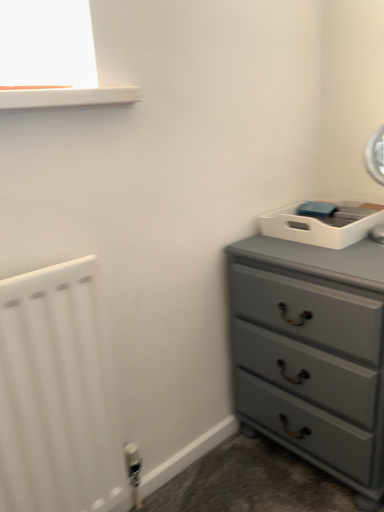
Question: Is white matte radiator at left located within matte gray dresser at right?

Choices:
 (A) no
 (B) yes

Answer: (A)

Question: Is matte gray dresser at right further to camera compared to white matte radiator at left?

Choices:
 (A) yes
 (B) no

Answer: (A)

Question: Considering the relative sizes of matte gray dresser at right and white matte radiator at left in the image provided, is matte gray dresser at right smaller than white matte radiator at left?

Choices:
 (A) yes
 (B) no

Answer: (B)

Question: Is matte gray dresser at right oriented away from white matte radiator at left?

Choices:
 (A) no
 (B) yes

Answer: (A)

Question: Are matte gray dresser at right and white matte radiator at left located far from each other?

Choices:
 (A) no
 (B) yes

Answer: (A)

Question: Considering the relative sizes of matte gray dresser at right and white matte radiator at left in the image provided, is matte gray dresser at right thinner than white matte radiator at left?

Choices:
 (A) yes
 (B) no

Answer: (B)

Question: Does white matte radiator at left have a larger size compared to matte gray dresser at right?

Choices:
 (A) yes
 (B) no

Answer: (B)

Question: From a real-world perspective, is white matte radiator at left physically below matte gray dresser at right?

Choices:
 (A) no
 (B) yes

Answer: (A)

Question: Can you confirm if white matte radiator at left is smaller than matte gray dresser at right?

Choices:
 (A) yes
 (B) no

Answer: (A)

Question: Is white matte radiator at left located outside matte gray dresser at right?

Choices:
 (A) no
 (B) yes

Answer: (B)

Question: Considering the relative sizes of white matte radiator at left and matte gray dresser at right in the image provided, is white matte radiator at left shorter than matte gray dresser at right?

Choices:
 (A) no
 (B) yes

Answer: (A)

Question: Does white matte radiator at left lie in front of matte gray dresser at right?

Choices:
 (A) no
 (B) yes

Answer: (B)

Question: In terms of width, does white matte radiator at left look wider or thinner when compared to matte gray dresser at right?

Choices:
 (A) wide
 (B) thin

Answer: (B)